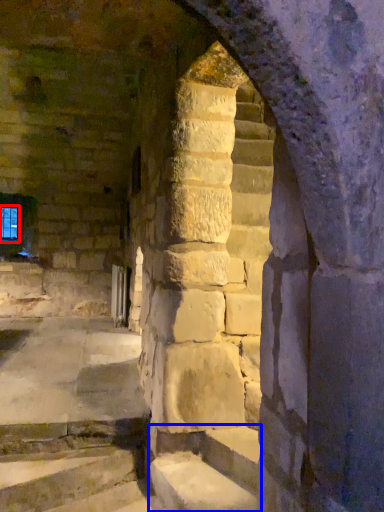
Question: Which object appears closest to the camera in this image, glass window (highlighted by a red box) or stairwell (highlighted by a blue box)?

Choices:
 (A) glass window
 (B) stairwell

Answer: (B)